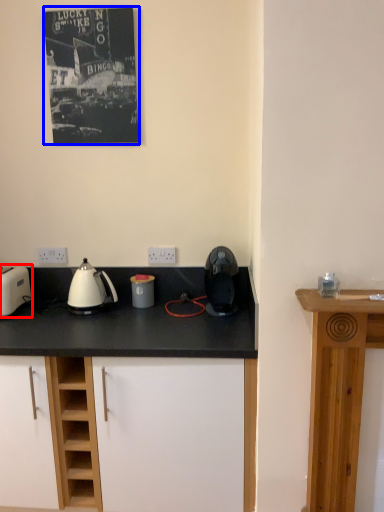
Question: Among these objects, which one is nearest to the camera, toaster (highlighted by a red box) or picture frame (highlighted by a blue box)?

Choices:
 (A) toaster
 (B) picture frame

Answer: (A)